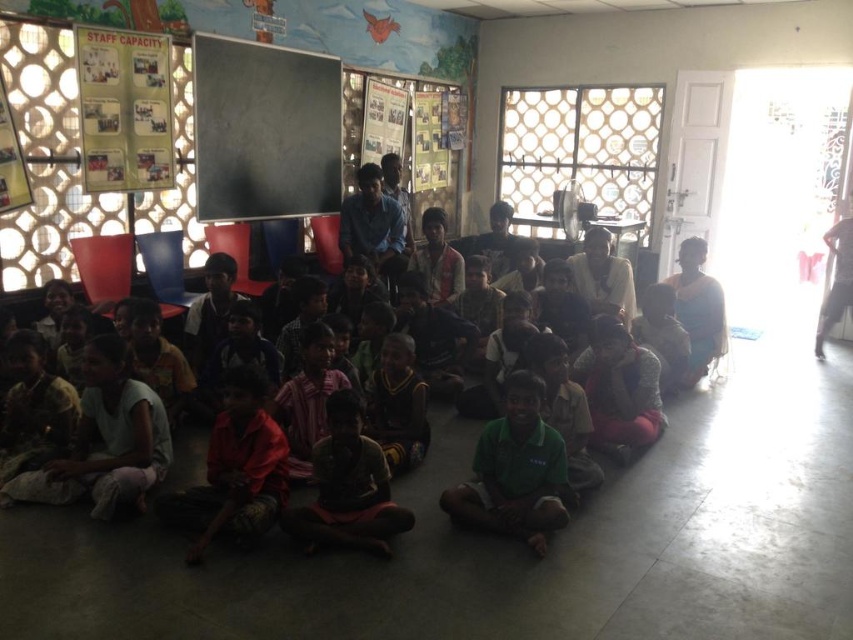
Does green fabric shirt at center appear on the right side of red cotton shirt at lower left?

Indeed, green fabric shirt at center is positioned on the right side of red cotton shirt at lower left.

Can you confirm if green fabric shirt at center is positioned to the left of red cotton shirt at lower left?

In fact, green fabric shirt at center is to the right of red cotton shirt at lower left.

Between point (554, 461) and point (276, 480), which one is positioned behind?

Positioned behind is point (276, 480).

The height and width of the screenshot is (640, 853). What are the coordinates of `green fabric shirt at center` in the screenshot? It's located at (515, 472).

Where is `green fabric shirt at center`? The image size is (853, 640). green fabric shirt at center is located at coordinates (515, 472).

Can you confirm if green fabric shirt at center is bigger than dark green fabric at lower center?

Incorrect, green fabric shirt at center is not larger than dark green fabric at lower center.

Is point (531, 410) more distant than point (582, 381)?

That is False.

The height and width of the screenshot is (640, 853). Identify the location of green fabric shirt at center. (515, 472).

Can you confirm if red cotton shirt at lower left is bigger than dark green fabric at lower center?

Yes.

Who is more distant from viewer, (x=264, y=440) or (x=645, y=381)?

Positioned behind is point (x=645, y=381).

Locate an element on the screen. Image resolution: width=853 pixels, height=640 pixels. red cotton shirt at lower left is located at coordinates (235, 468).